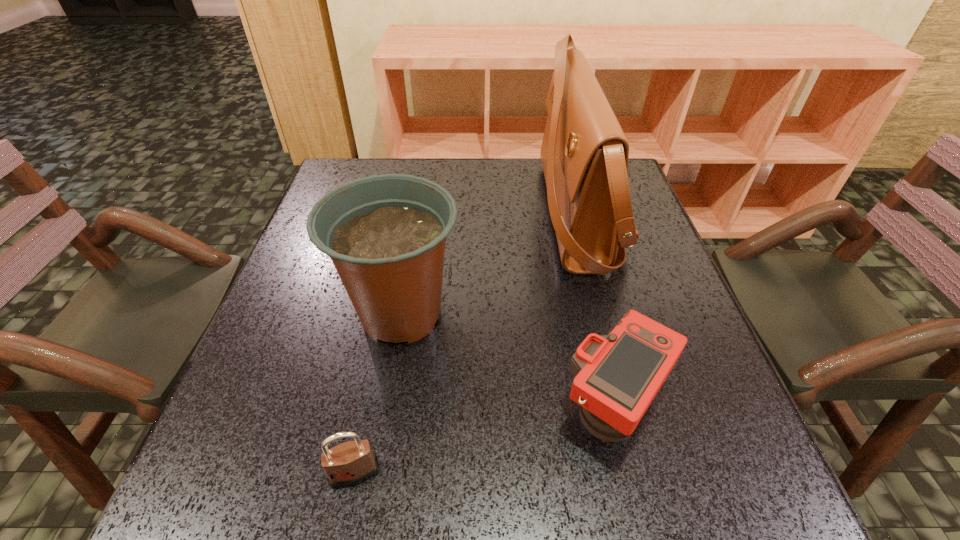
This screenshot has width=960, height=540. I want to click on vacant space at the left edge, so click(x=298, y=380).

Find the location of `vacant space at the right edge`. vacant space at the right edge is located at coordinates (677, 294).

Where is `vacant space at the far left corner`? The width and height of the screenshot is (960, 540). vacant space at the far left corner is located at coordinates (353, 164).

At what (x,y) coordinates should I click in order to perform the action: click on vacant space at the near left corner of the desktop. Please return your answer as a coordinate pair (x, y). The image size is (960, 540). Looking at the image, I should click on (277, 510).

You are a GUI agent. You are given a task and a screenshot of the screen. Output one action in this format:
    pyautogui.click(x=<x>, y=<y>)
    Task: Click on the vacant space that's between the third tallest object and the shortest object
    This screenshot has width=960, height=540.
    Given the screenshot: What is the action you would take?
    pyautogui.click(x=485, y=440)

Image resolution: width=960 pixels, height=540 pixels. In order to click on free space that is in between the satchel and the camera in this screenshot , I will do tap(595, 311).

This screenshot has width=960, height=540. In order to click on free space between the camera and the shortest object in this screenshot , I will do `click(485, 440)`.

I want to click on unoccupied area between the camera and the padlock, so click(485, 440).

Locate an element on the screen. The height and width of the screenshot is (540, 960). vacant area between the camera and the tallest object is located at coordinates (595, 311).

Image resolution: width=960 pixels, height=540 pixels. I want to click on vacant region between the camera and the second tallest object, so click(508, 360).